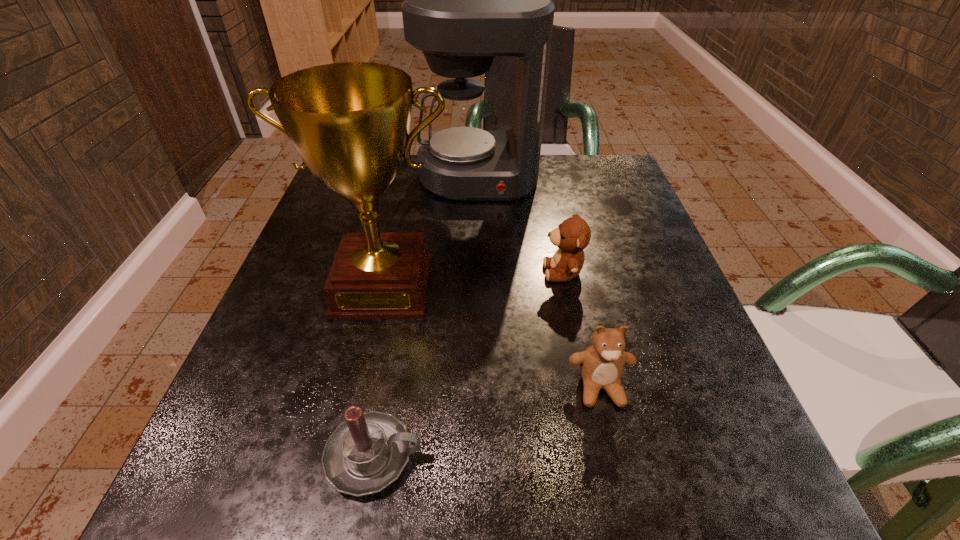
Where is `empty location between the nearest object and the farther teddy bear`? empty location between the nearest object and the farther teddy bear is located at coordinates (468, 364).

You are a GUI agent. You are given a task and a screenshot of the screen. Output one action in this format:
    pyautogui.click(x=<x>, y=<y>)
    Task: Click on the vacant area that lies between the nearer teddy bear and the award
    Image resolution: width=960 pixels, height=540 pixels.
    Given the screenshot: What is the action you would take?
    pyautogui.click(x=492, y=337)

Choose which object is the nearest neighbor to the award. Please provide its 2D coordinates. Your answer should be formatted as a tuple, i.e. [(x, y)], where the tuple contains the x and y coordinates of a point satisfying the conditions above.

[(573, 235)]

The height and width of the screenshot is (540, 960). Find the location of `object that is the third closest to the award`. object that is the third closest to the award is located at coordinates (466, 0).

Image resolution: width=960 pixels, height=540 pixels. In order to click on vacant space that satisfies the following two spatial constraints: 1. on the button side of the coffee maker; 2. on the side of the candle with the handle loop in this screenshot , I will do `click(477, 456)`.

I want to click on vacant area that satisfies the following two spatial constraints: 1. on the button side of the farthest object; 2. on the side of the nearest object with the handle loop, so click(477, 456).

The width and height of the screenshot is (960, 540). I want to click on free point that satisfies the following two spatial constraints: 1. on the front-facing side of the fourth farthest object; 2. on the side of the candle with the handle loop, so click(615, 456).

Find the location of a particular element. vacant area that satisfies the following two spatial constraints: 1. on the button side of the farthest object; 2. on the side of the nearest object with the handle loop is located at coordinates (477, 456).

You are a GUI agent. You are given a task and a screenshot of the screen. Output one action in this format:
    pyautogui.click(x=<x>, y=<y>)
    Task: Click on the free space that satisfies the following two spatial constraints: 1. on the face of the farther teddy bear; 2. on the plaque of the award
    
    Given the screenshot: What is the action you would take?
    pyautogui.click(x=566, y=286)